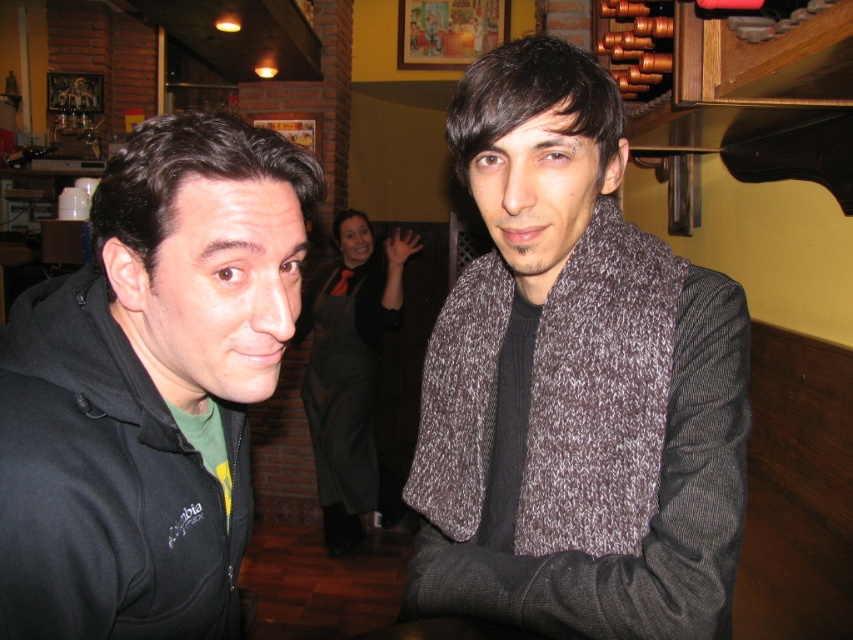
You are a photographer standing at the camera position. You want to take a closeup of the knitted gray scarf at center without moving the camera. Is the scarf within the camera frame?

The knitted gray scarf at center is 24.09 inches from camera, so yes, it is within the camera frame.

You are standing at the center of the image and want to place a small plant pot exactly at the point marked as point (x=149, y=387). Which object from the scene will the plant pot be closest to?

The plant pot will be closest to the black matte hoodie at left located at point (x=149, y=387).

You are trying to locate the knitted gray scarf at center in the image. According to the scene description, where exactly is it positioned?

The knitted gray scarf at center is located at point (x=573, y=384).